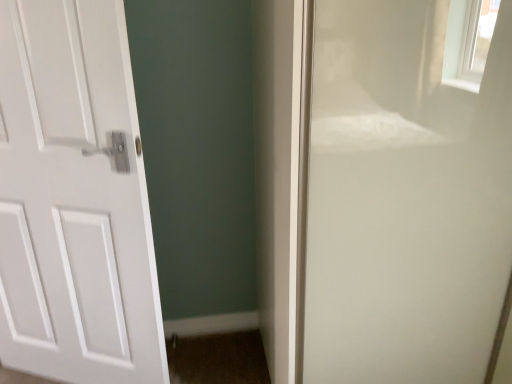
Question: From the image's perspective, is transparent glass screen door at right above white matte door at left?

Choices:
 (A) no
 (B) yes

Answer: (B)

Question: Would you say transparent glass screen door at right is a long distance from white matte door at left?

Choices:
 (A) yes
 (B) no

Answer: (B)

Question: Can you confirm if transparent glass screen door at right is positioned to the right of white matte door at left?

Choices:
 (A) no
 (B) yes

Answer: (B)

Question: Is white matte door at left a part of transparent glass screen door at right?

Choices:
 (A) no
 (B) yes

Answer: (A)

Question: Is transparent glass screen door at right wider than white matte door at left?

Choices:
 (A) yes
 (B) no

Answer: (A)

Question: Can you see transparent glass screen door at right touching white matte door at left?

Choices:
 (A) no
 (B) yes

Answer: (A)

Question: Considering the relative sizes of white matte door at left and transparent glass screen door at right in the image provided, is white matte door at left taller than transparent glass screen door at right?

Choices:
 (A) yes
 (B) no

Answer: (B)

Question: Is white matte door at left at the left side of transparent glass screen door at right?

Choices:
 (A) yes
 (B) no

Answer: (A)

Question: Is white matte door at left beside transparent glass screen door at right?

Choices:
 (A) no
 (B) yes

Answer: (A)

Question: Is white matte door at left behind transparent glass screen door at right?

Choices:
 (A) no
 (B) yes

Answer: (B)

Question: Does white matte door at left appear on the right side of transparent glass screen door at right?

Choices:
 (A) no
 (B) yes

Answer: (A)

Question: Is there a large distance between white matte door at left and transparent glass screen door at right?

Choices:
 (A) yes
 (B) no

Answer: (B)

Question: In terms of size, does transparent glass screen door at right appear bigger or smaller than white matte door at left?

Choices:
 (A) big
 (B) small

Answer: (A)